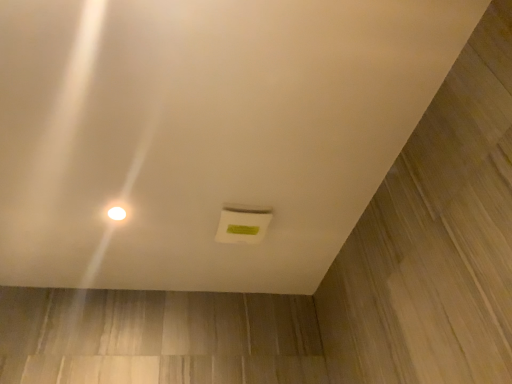
At what (x,y) coordinates should I click in order to perform the action: click on free space to the right of white glossy light bulb at upper left. Please return your answer as a coordinate pair (x, y). The height and width of the screenshot is (384, 512). Looking at the image, I should click on (165, 205).